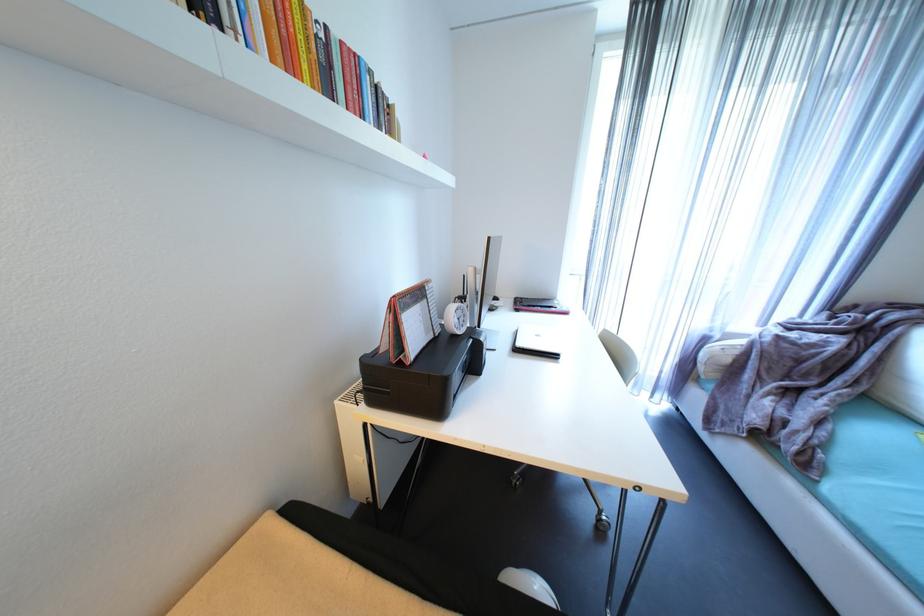
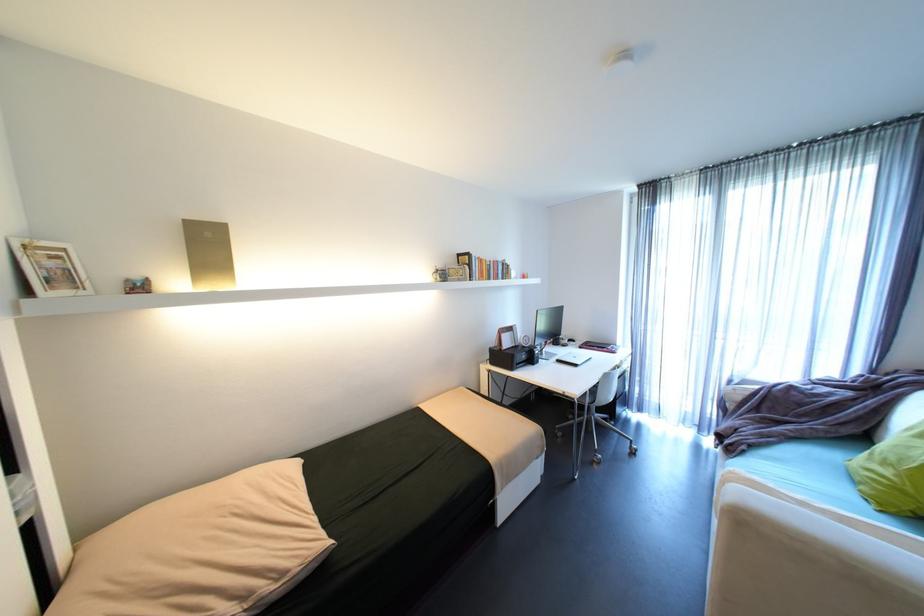
The point at (496, 238) is marked in the first image. Where is the corresponding point in the second image?

(544, 310)